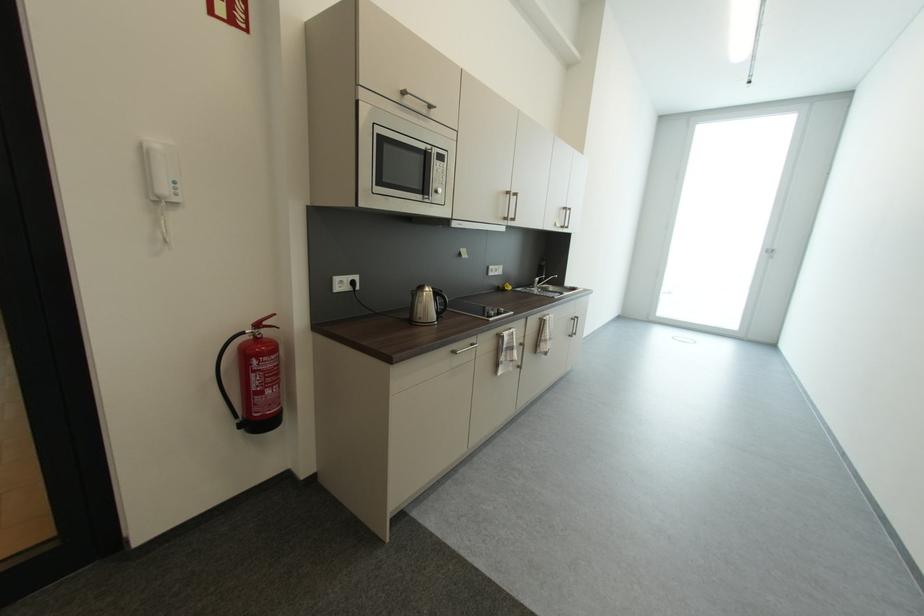
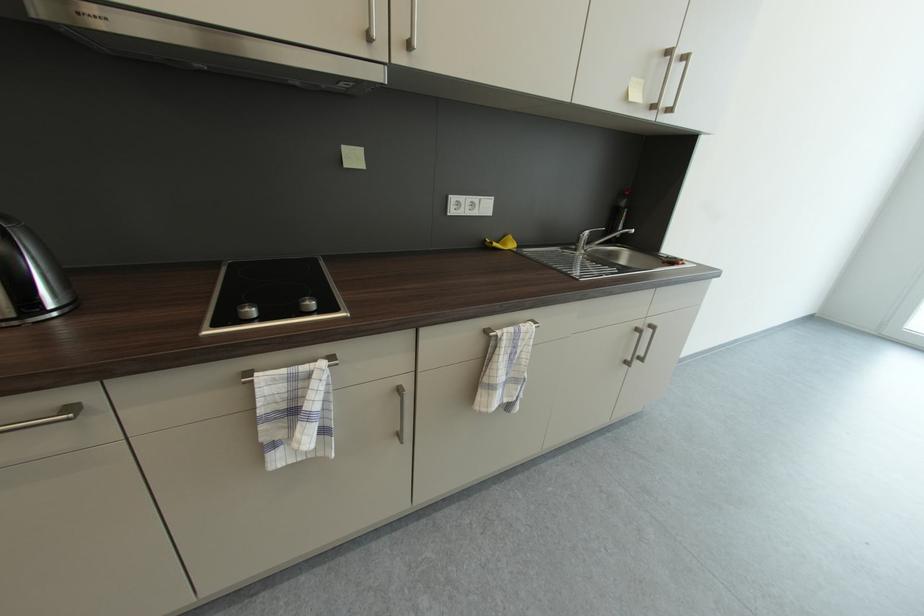
Which direction would the cameraman need to move to produce the second image?

The cameraman walked toward right, forward.